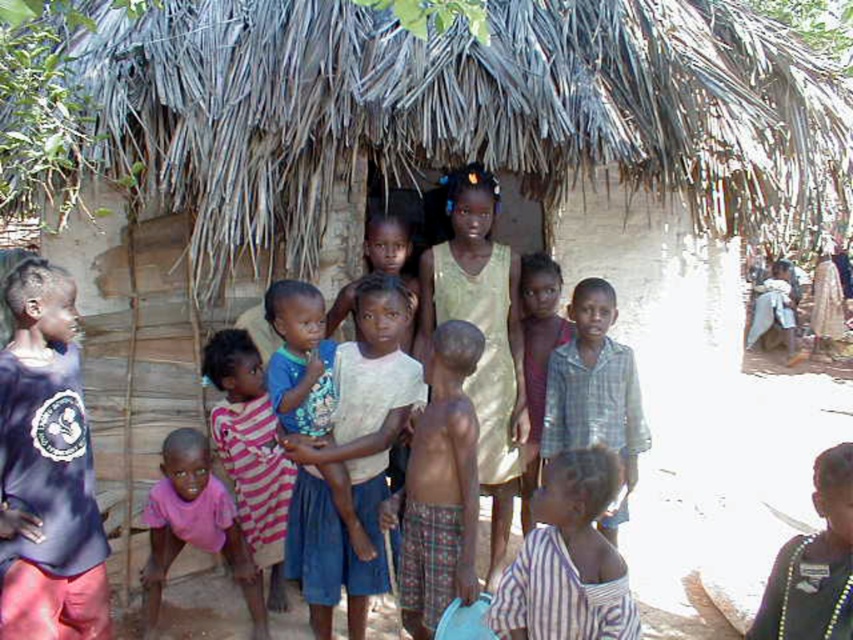
Consider the image. Does skinny fabric shirt at center appear on the right side of pink striped shirt at center?

Indeed, skinny fabric shirt at center is positioned on the right side of pink striped shirt at center.

Does skinny fabric shirt at center appear on the left side of pink striped shirt at center?

No, skinny fabric shirt at center is not to the left of pink striped shirt at center.

What do you see at coordinates (439, 486) in the screenshot?
I see `skinny fabric shirt at center` at bounding box center [439, 486].

Identify the location of skinny fabric shirt at center. (439, 486).

Which is below, striped fabric at lower right or blue denim shorts at center?

striped fabric at lower right is below.

Who is higher up, striped fabric at lower right or blue denim shorts at center?

Positioned higher is blue denim shorts at center.

Is point (558, 554) positioned in front of point (322, 300)?

Yes, it is in front of point (322, 300).

The width and height of the screenshot is (853, 640). Identify the location of striped fabric at lower right. (567, 561).

Can you confirm if plaid fabric shirt at center is positioned to the right of pink fabric shirt at lower left?

Yes, plaid fabric shirt at center is to the right of pink fabric shirt at lower left.

Does point (640, 404) come closer to viewer compared to point (253, 566)?

Yes.

The width and height of the screenshot is (853, 640). I want to click on plaid fabric shirt at center, so pyautogui.click(x=595, y=394).